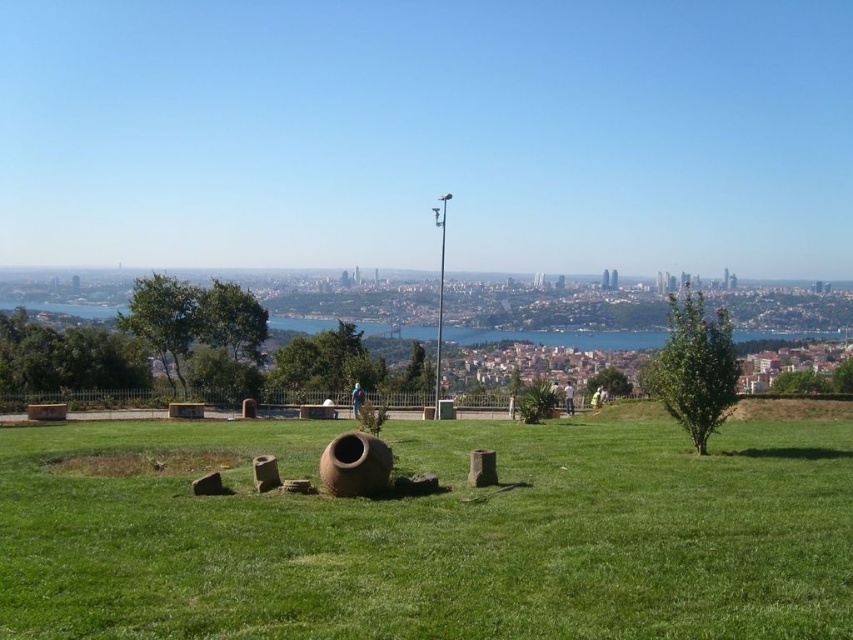
Looking at this image, who is more forward, (358, 556) or (354, 396)?

Point (358, 556) is in front.

This screenshot has height=640, width=853. Describe the element at coordinates (434, 536) in the screenshot. I see `green grassy at center` at that location.

Find the location of a particular element. Image resolution: width=853 pixels, height=640 pixels. green grassy at center is located at coordinates (434, 536).